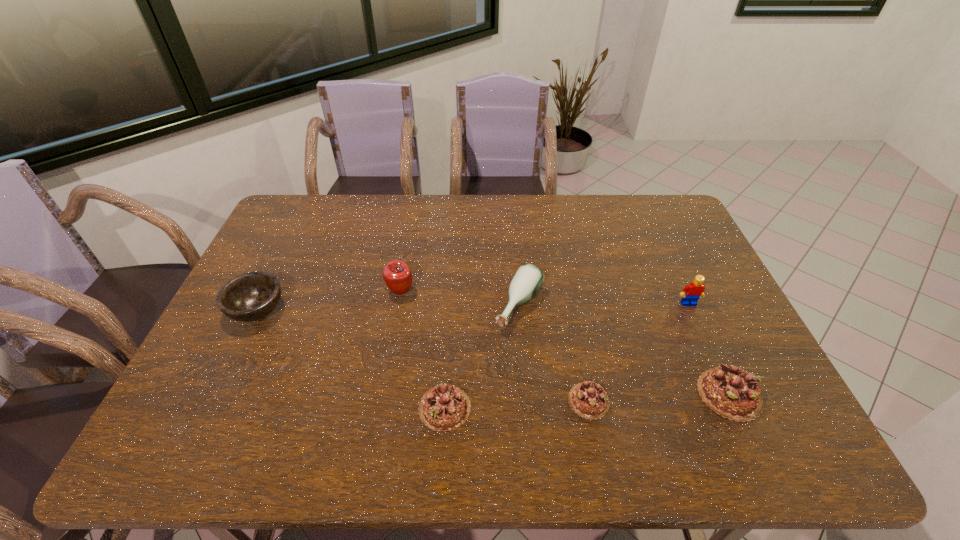
You are a GUI agent. You are given a task and a screenshot of the screen. Output one action in this format:
    pyautogui.click(x=<x>, y=<y>)
    Task: Click on the third object from left to right
    The height and width of the screenshot is (540, 960).
    Given the screenshot: What is the action you would take?
    click(445, 407)

Identify the location of the leftmost chocolate cake. (445, 407).

Image resolution: width=960 pixels, height=540 pixels. I want to click on the shortest chocolate cake, so click(589, 400).

Locate an element on the screen. The width and height of the screenshot is (960, 540). the second chocolate cake from left to right is located at coordinates (589, 400).

This screenshot has width=960, height=540. Identify the location of the rightmost chocolate cake. (731, 392).

I want to click on apple, so click(397, 275).

Locate an element on the screen. The width and height of the screenshot is (960, 540). the fourth object from left to right is located at coordinates (528, 279).

You are a GUI agent. You are given a task and a screenshot of the screen. Output one action in this format:
    pyautogui.click(x=<x>, y=<y>)
    Task: Click on the bowl
    This screenshot has width=960, height=540.
    Given the screenshot: What is the action you would take?
    pyautogui.click(x=251, y=296)

At what (x,y) coordinates should I click in order to perform the action: click on Lego. Please return your answer as a coordinate pair (x, y). Looking at the image, I should click on (691, 293).

Where is `free point located on the left of the sixth tallest object`? This screenshot has width=960, height=540. free point located on the left of the sixth tallest object is located at coordinates (326, 408).